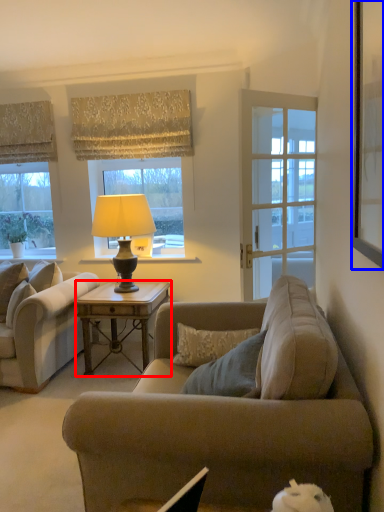
Question: Which of the following is the closest to the observer, desk (highlighted by a red box) or picture frame (highlighted by a blue box)?

Choices:
 (A) desk
 (B) picture frame

Answer: (B)